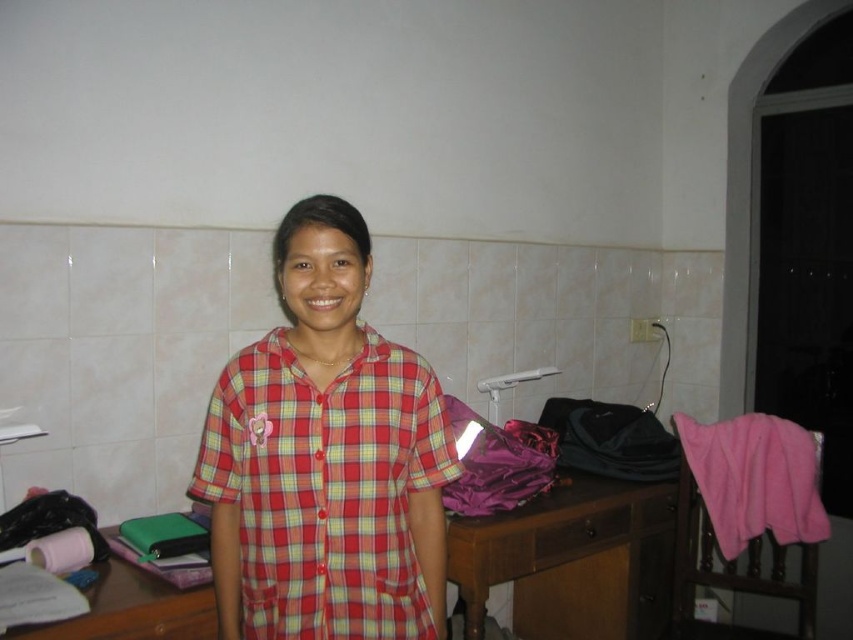
Based on the photo, you are a photographer setting up a shoot in this room. You need to position a 1.8m tall model so that they are visible in the frame without being blocked by the brown wooden table at lower right. Given the red plaid shirt at center is currently worn by the model, can the model stand in a way that their full height is visible while avoiding the table?

The red plaid shirt at center has a lesser height compared to brown wooden table at lower right. Since the model is 1.8m tall and the table is taller than the shirt, the model can stand in a position where they are closer to the camera and angled away from the table to ensure their full height remains visible without obstruction from the table.

From the picture: You are a security camera in the room. You see a person standing near the desk. There is a point marked at coordinate (135, 605). What object is located at that point?

The point at coordinate (135, 605) indicates the pink leather wallet at lower left.

You are organizing a cozy reading corner and need to place the pink fleece blanket at right and the wooden drawer at center. Which object should you move first to make space for a new armchair?

The wooden drawer at center should be moved first because the pink fleece blanket at right is already to the right of it, so moving the drawer first would allow space for the armchair without disturbing the blanket.